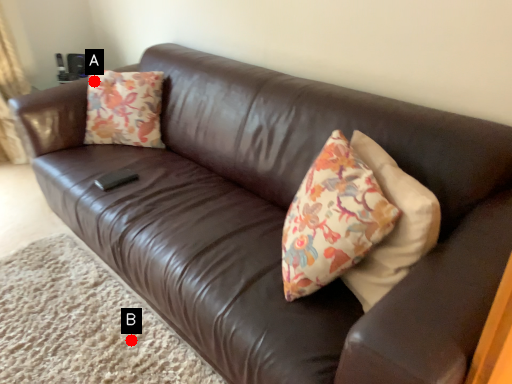
Question: Two points are circled on the image, labeled by A and B beside each circle. Among these points, which one is nearest to the camera?

Choices:
 (A) A is closer
 (B) B is closer

Answer: (B)